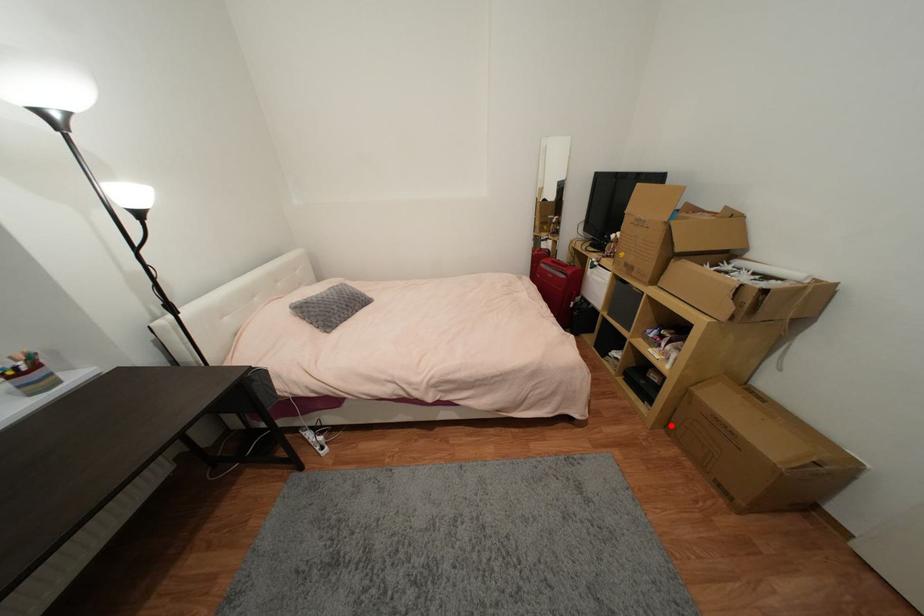
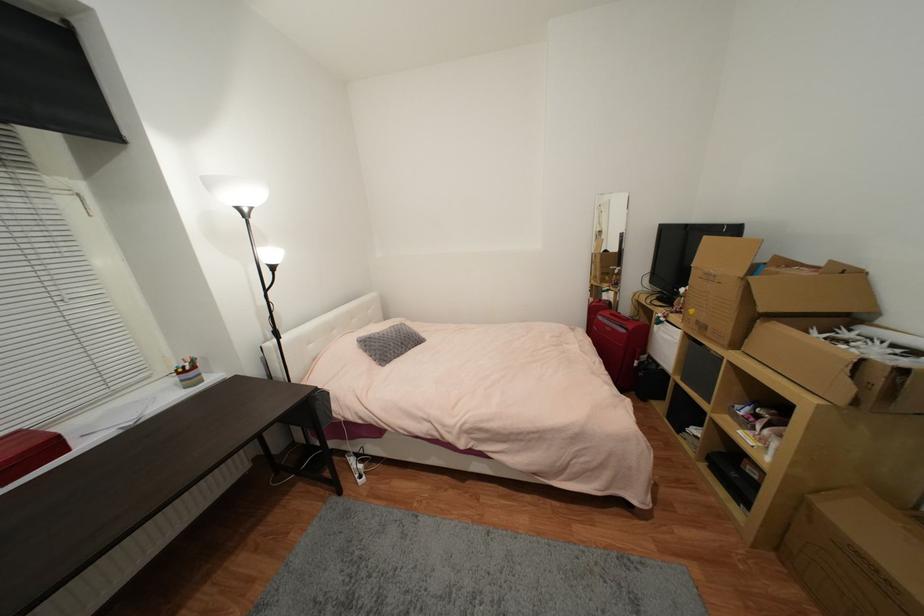
Where in the second image is the point corresponding to the highlighted location from the first image?

(782, 546)